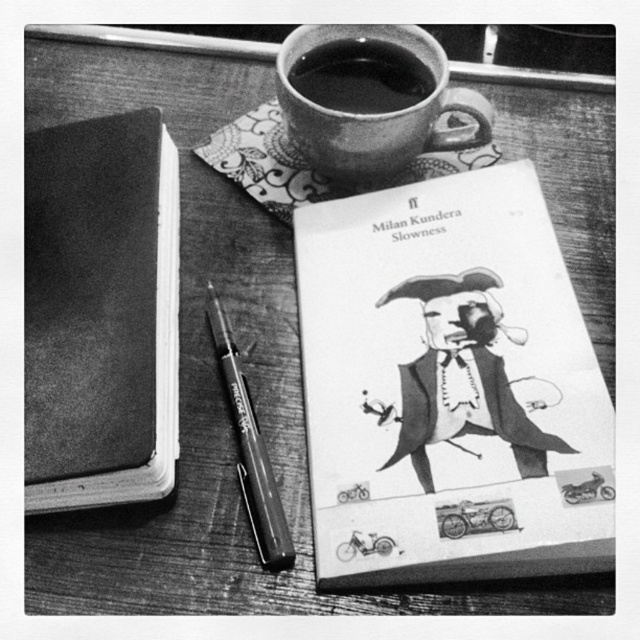
Is black ceramic mug at upper center wider than metallic pen at center?

Indeed, black ceramic mug at upper center has a greater width compared to metallic pen at center.

Is point (362, 100) positioned in front of point (234, 426)?

No, it is behind (234, 426).

Is point (346, 65) positioned behind point (257, 525)?

Yes, it is behind point (257, 525).

The height and width of the screenshot is (640, 640). I want to click on black ceramic mug at upper center, so pyautogui.click(x=362, y=76).

Does matte ceramic mug at upper center lie in front of metallic pen at center?

No, it is behind metallic pen at center.

Between matte ceramic mug at upper center and metallic pen at center, which one appears on the left side from the viewer's perspective?

metallic pen at center

In the scene shown: Who is more forward, (413, 35) or (252, 417)?

Positioned in front is point (252, 417).

At what (x,y) coordinates should I click in order to perform the action: click on matte ceramic mug at upper center. Please return your answer as a coordinate pair (x, y). Looking at the image, I should click on (374, 113).

Is point (394, 448) farther from camera compared to point (220, 353)?

No, it is in front of (220, 353).

Find the location of `paperback book at center`. paperback book at center is located at coordinates (449, 387).